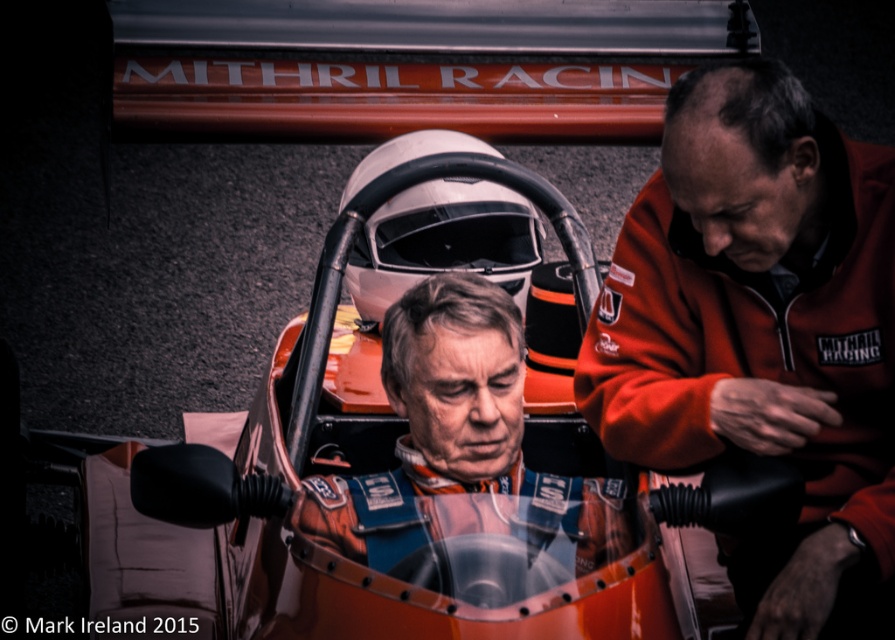
You are standing in front of the racing car and see two points marked on the car. The first point is at coordinate point (x=853, y=285) and the second is at point (x=518, y=387). Which point is closer to the front of the car?

Point (x=853, y=285) is in front of point 0.606, 0.81, so the first point is closer to the front of the car.

You are a photographer standing in front of the orange metallic car at center and the orange softshell jacket at right. You want to take a photo that includes both objects in the frame. Based on their positions, which object should you place on the left side of the photo to include both?

The orange metallic car at center is positioned on the left side of orange softshell jacket at right. Therefore, to include both in the frame, you should place the orange metallic car at center on the left side of the photo and the orange softshell jacket at right on the right side.